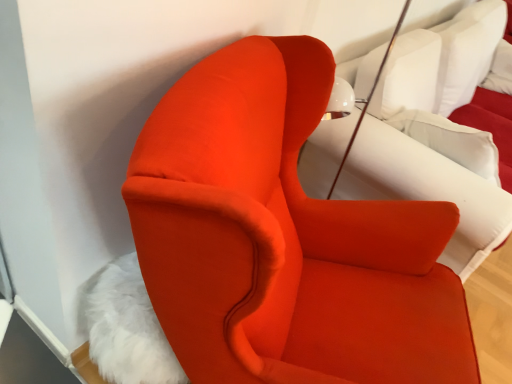
You are a GUI agent. You are given a task and a screenshot of the screen. Output one action in this format:
    pyautogui.click(x=<x>, y=<y>)
    Task: Click on the white soft pillow at upper right
    Image resolution: width=512 pixels, height=384 pixels.
    Given the screenshot: What is the action you would take?
    pyautogui.click(x=467, y=52)

Locate an element on the screen. The image size is (512, 384). matte orange armchair at center is located at coordinates (x=284, y=238).

Where is `white fluffy rug at lower left`? The height and width of the screenshot is (384, 512). white fluffy rug at lower left is located at coordinates (126, 327).

Is white fluffy rug at lower left in contact with white soft pillow at upper right?

No, white fluffy rug at lower left is not touching white soft pillow at upper right.

Based on their positions, is white fluffy rug at lower left located to the left or right of white soft pillow at upper right?

white fluffy rug at lower left is positioned on white soft pillow at upper right's left side.

Between white fluffy rug at lower left and white soft pillow at upper right, which one is positioned behind?

white soft pillow at upper right is more distant.

Could you tell me if velvet white bed at center is turned towards white soft pillow at upper right?

Yes, velvet white bed at center is facing white soft pillow at upper right.

Visually, is velvet white bed at center positioned to the left or to the right of white soft pillow at upper right?

velvet white bed at center is to the left of white soft pillow at upper right.

How much distance is there between velvet white bed at center and white soft pillow at upper right?

velvet white bed at center and white soft pillow at upper right are 11.05 inches apart.

From a real-world perspective, which is physically below, velvet white bed at center or white soft pillow at upper right?

velvet white bed at center.

Is white soft pillow at upper right in front of or behind white fluffy rug at lower left in the image?

white soft pillow at upper right is positioned farther from the viewer than white fluffy rug at lower left.

Considering the positions of point (471, 89) and point (128, 324), is point (471, 89) closer or farther from the camera than point (128, 324)?

Clearly, point (471, 89) is more distant from the camera than point (128, 324).

In the scene shown: From a real-world perspective, is white soft pillow at upper right below white fluffy rug at lower left?

No, from a real-world perspective, white soft pillow at upper right is not under white fluffy rug at lower left.

Between white soft pillow at upper right and white fluffy rug at lower left, which one has smaller size?

With smaller size is white fluffy rug at lower left.

Is matte orange armchair at center positioned with its back to white soft pillow at upper right?

No, white soft pillow at upper right is not at the back of matte orange armchair at center.

Which object is positioned more to the right, matte orange armchair at center or white soft pillow at upper right?

Positioned to the right is white soft pillow at upper right.

From the image's perspective, is matte orange armchair at center on white soft pillow at upper right?

No, from the image's perspective, matte orange armchair at center is not above white soft pillow at upper right.

In the scene shown: Considering the sizes of matte orange armchair at center and white soft pillow at upper right in the image, is matte orange armchair at center taller or shorter than white soft pillow at upper right?

Clearly, matte orange armchair at center is taller compared to white soft pillow at upper right.

From the image's perspective, relative to velvet white bed at center, is white fluffy rug at lower left above or below?

white fluffy rug at lower left is situated lower than velvet white bed at center in the image.

Locate an element on the screen. bed that appears behind the white fluffy rug at lower left is located at coordinates (436, 133).

Does white fluffy rug at lower left contain velvet white bed at center?

That's incorrect, velvet white bed at center is not inside white fluffy rug at lower left.

Considering the positions of objects white fluffy rug at lower left and matte orange armchair at center in the image provided, who is more to the left, white fluffy rug at lower left or matte orange armchair at center?

white fluffy rug at lower left is more to the left.

What are the coordinates of `chair that is in front of the white fluffy rug at lower left` in the screenshot? It's located at (284, 238).

Between white fluffy rug at lower left and matte orange armchair at center, which one has more height?

matte orange armchair at center.

Is white fluffy rug at lower left inside the boundaries of matte orange armchair at center, or outside?

white fluffy rug at lower left is spatially positioned inside matte orange armchair at center.

The height and width of the screenshot is (384, 512). I want to click on bed below the white soft pillow at upper right (from a real-world perspective), so click(436, 133).

From a real-world perspective, is white soft pillow at upper right positioned under velvet white bed at center based on gravity?

No, from a real-world perspective, white soft pillow at upper right is not below velvet white bed at center.

Is white soft pillow at upper right positioned in front of velvet white bed at center?

No, it is not.

Considering the relative sizes of white soft pillow at upper right and velvet white bed at center in the image provided, is white soft pillow at upper right thinner than velvet white bed at center?

Correct, the width of white soft pillow at upper right is less than that of velvet white bed at center.

The width and height of the screenshot is (512, 384). I want to click on animal that appears in front of the white soft pillow at upper right, so click(126, 327).

Find the location of a particular element. This screenshot has height=384, width=512. pillow that is above the velvet white bed at center (from a real-world perspective) is located at coordinates (467, 52).

When comparing their distances from white soft pillow at upper right, does matte orange armchair at center or white fluffy rug at lower left seem closer?

Based on the image, matte orange armchair at center appears to be nearer to white soft pillow at upper right.

Based on their spatial positions, is white soft pillow at upper right or matte orange armchair at center further from white fluffy rug at lower left?

white soft pillow at upper right.

When comparing their distances from velvet white bed at center, does matte orange armchair at center or white soft pillow at upper right seem closer?

white soft pillow at upper right is closer to velvet white bed at center.

Estimate the real-world distances between objects in this image. Which object is further from matte orange armchair at center, velvet white bed at center or white soft pillow at upper right?

The object further to matte orange armchair at center is white soft pillow at upper right.

Based on their spatial positions, is matte orange armchair at center or white soft pillow at upper right closer to white fluffy rug at lower left?

matte orange armchair at center lies closer to white fluffy rug at lower left than the other object.

Considering their positions, is matte orange armchair at center positioned further to white fluffy rug at lower left than velvet white bed at center?

velvet white bed at center.

When comparing their distances from white soft pillow at upper right, does white fluffy rug at lower left or matte orange armchair at center seem closer?

The object closer to white soft pillow at upper right is matte orange armchair at center.

Considering their positions, is velvet white bed at center positioned closer to white soft pillow at upper right than white fluffy rug at lower left?

velvet white bed at center lies closer to white soft pillow at upper right than the other object.

Find the location of a particular element. Image resolution: width=512 pixels, height=384 pixels. bed located between matte orange armchair at center and white soft pillow at upper right in the depth direction is located at coordinates (436, 133).

In order to click on animal between matte orange armchair at center and white soft pillow at upper right in the front-back direction in this screenshot , I will do `click(126, 327)`.

Locate an element on the screen. The image size is (512, 384). bed between white fluffy rug at lower left and white soft pillow at upper right in the horizontal direction is located at coordinates [436, 133].

Where is `chair between white fluffy rug at lower left and velvet white bed at center`? This screenshot has width=512, height=384. chair between white fluffy rug at lower left and velvet white bed at center is located at coordinates (284, 238).